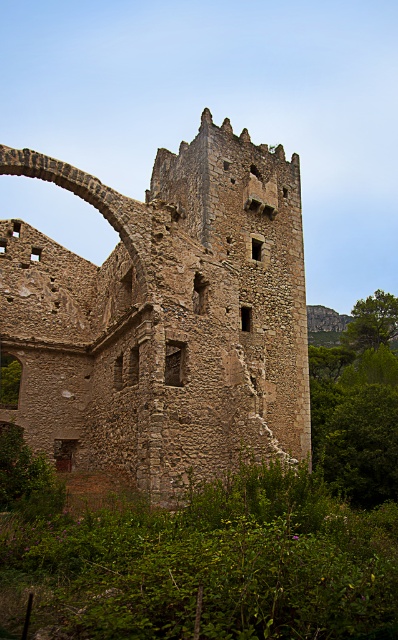
Is rustic stone tower at center behind green leafy vegetation at center?

That is True.

Locate an element on the screen. The image size is (398, 640). rustic stone tower at center is located at coordinates (165, 316).

At what (x,y) coordinates should I click in order to perform the action: click on rustic stone tower at center. Please return your answer as a coordinate pair (x, y). The width and height of the screenshot is (398, 640). Looking at the image, I should click on (165, 316).